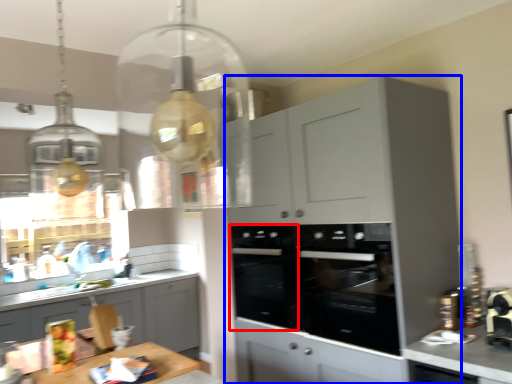
Question: Which object is closer to the camera taking this photo, oven (highlighted by a red box) or cabinetry (highlighted by a blue box)?

Choices:
 (A) oven
 (B) cabinetry

Answer: (B)